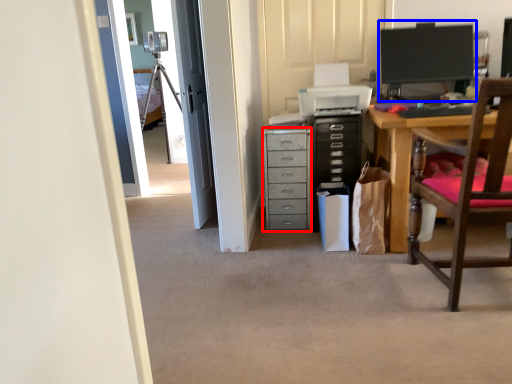
Question: Which object appears closest to the camera in this image, chest of drawers (highlighted by a red box) or computer monitor (highlighted by a blue box)?

Choices:
 (A) chest of drawers
 (B) computer monitor

Answer: (B)